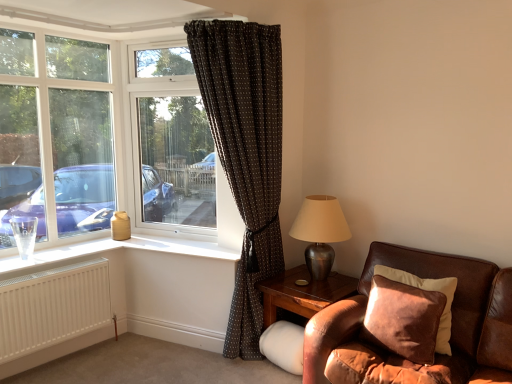
Question: From their relative heights in the image, would you say brown leather couch at lower right is taller or shorter than brown corduroy pillow at lower right?

Choices:
 (A) tall
 (B) short

Answer: (A)

Question: Is brown leather couch at lower right wider or thinner than brown corduroy pillow at lower right?

Choices:
 (A) wide
 (B) thin

Answer: (A)

Question: Considering the real-world distances, which object is closest to the brown dotted fabric curtain at left?

Choices:
 (A) brown corduroy pillow at lower right
 (B) white plastic window frame at left
 (C) transparent glass window at center
 (D) white matte radiator at lower left
 (E) wooden side table at lower right

Answer: (E)

Question: Which of these objects is positioned farthest from the brown leather couch at lower right?

Choices:
 (A) brown dotted fabric curtain at left
 (B) metallic silver table lamp at right
 (C) transparent glass window at center
 (D) brown corduroy pillow at lower right
 (E) white plastic window frame at left

Answer: (E)